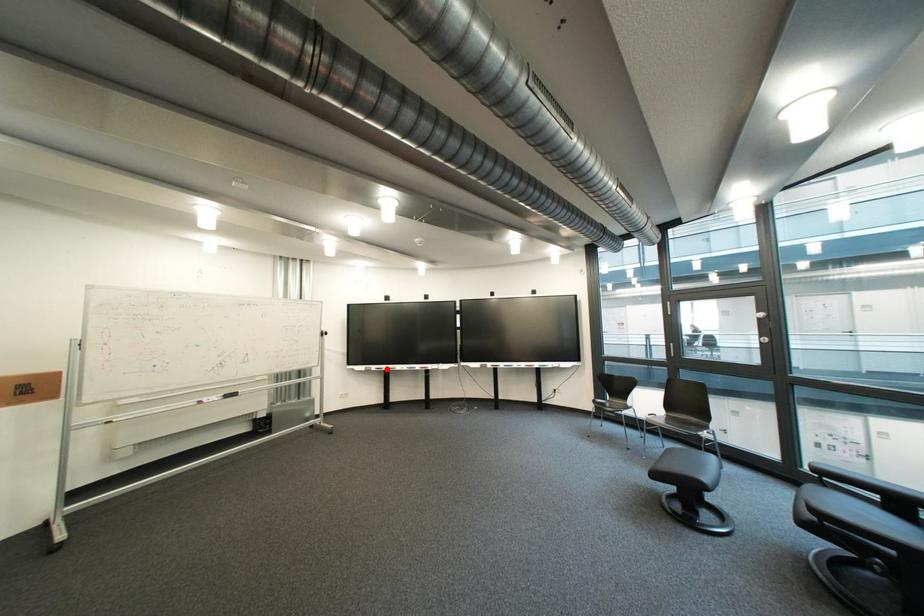
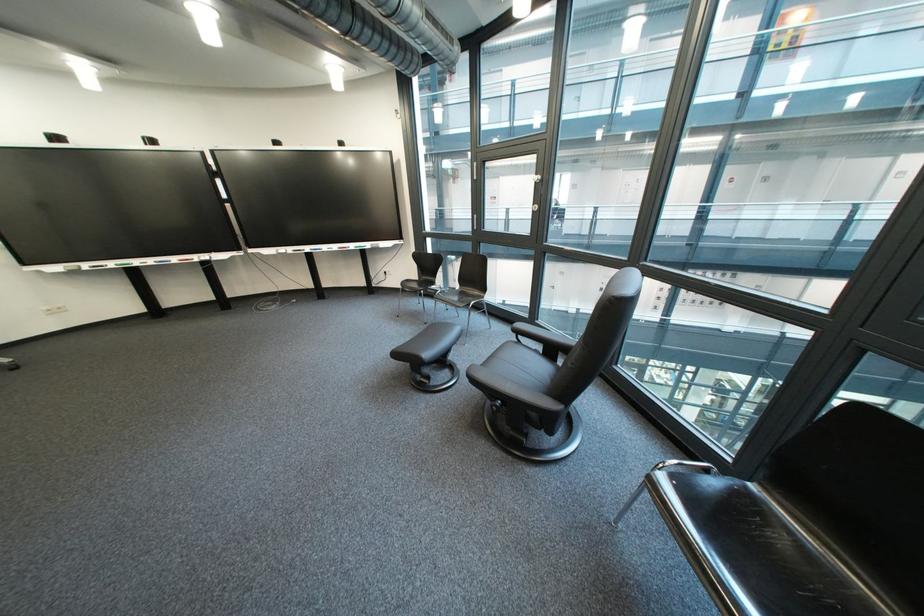
The point at the highlighted location is marked in the first image. Where is the corresponding point in the second image?

(100, 267)